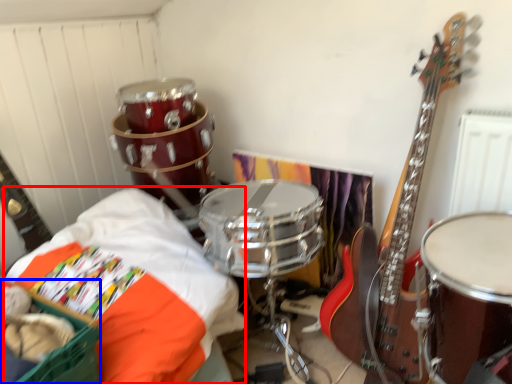
Question: Which object appears farthest to the camera in this image, sheet (highlighted by a red box) or basket (highlighted by a blue box)?

Choices:
 (A) sheet
 (B) basket

Answer: (A)